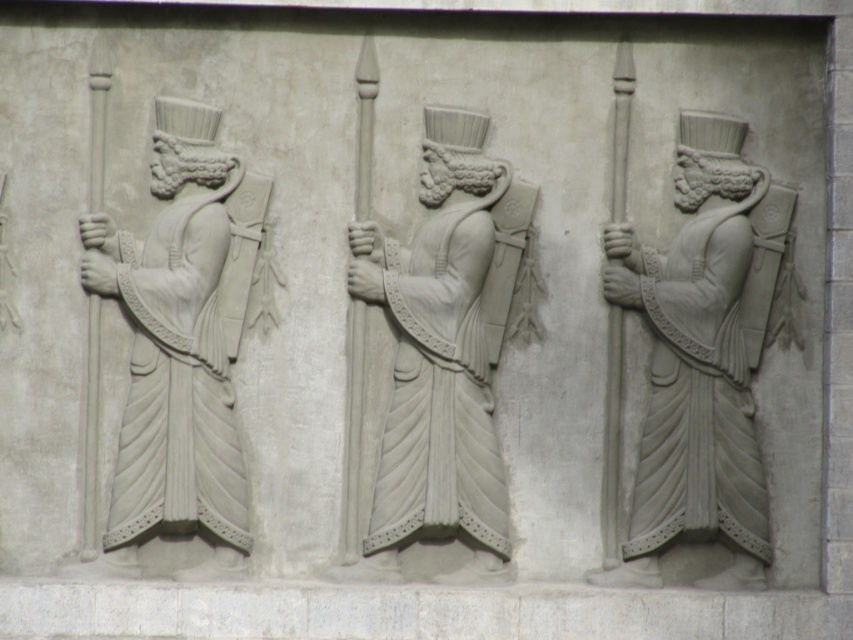
Consider the image. Between white stone warrior at right and white stone figure at center, which one appears on the right side from the viewer's perspective?

From the viewer's perspective, white stone warrior at right appears more on the right side.

Which is below, white stone warrior at right or white stone figure at center?

white stone warrior at right is lower down.

Is point (726, 444) positioned in front of point (466, 266)?

No, (726, 444) is further to viewer.

Identify the location of white stone warrior at right. (701, 356).

Does white stone warrior at right have a greater height compared to white stone figure at left?

Indeed, white stone warrior at right has a greater height compared to white stone figure at left.

Which is in front, point (654, 572) or point (177, 212)?

Point (177, 212) is in front.

Is point (755, 269) positioned before point (189, 349)?

No, (755, 269) is behind (189, 349).

Locate an element on the screen. white stone warrior at right is located at coordinates (701, 356).

Which of these two, white stone figure at center or white stone figure at left, stands shorter?

Standing shorter between the two is white stone figure at center.

Between white stone figure at center and white stone figure at left, which one appears on the left side from the viewer's perspective?

Positioned to the left is white stone figure at left.

Which is behind, point (427, 316) or point (227, 358)?

Positioned behind is point (227, 358).

You are a GUI agent. You are given a task and a screenshot of the screen. Output one action in this format:
    pyautogui.click(x=<x>, y=<y>)
    Task: Click on the white stone figure at center
    Image resolution: width=853 pixels, height=640 pixels.
    Given the screenshot: What is the action you would take?
    pyautogui.click(x=444, y=352)